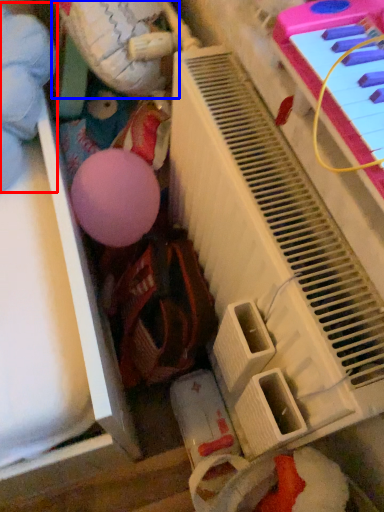
Question: Which of the following is the farthest to the observer, toy (highlighted by a red box) or toy (highlighted by a blue box)?

Choices:
 (A) toy
 (B) toy

Answer: (A)